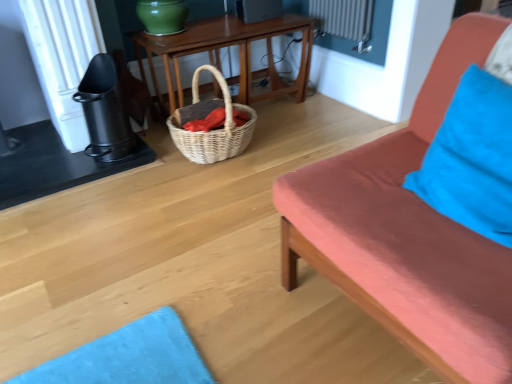
Question: Looking at the image, does blue fabric pillow at right seem bigger or smaller compared to woven wood table at center?

Choices:
 (A) small
 (B) big

Answer: (A)

Question: From a real-world perspective, relative to woven wood table at center, is blue fabric pillow at right vertically above or below?

Choices:
 (A) above
 (B) below

Answer: (A)

Question: Which is nearer to the woven wicker basket at center?

Choices:
 (A) matte coral studio couch at right
 (B) woven natural picnic basket at center
 (C) woven wood table at center
 (D) blue fabric pillow at right

Answer: (B)

Question: Which object is the closest to the woven natural picnic basket at center?

Choices:
 (A) matte coral studio couch at right
 (B) woven wood table at center
 (C) blue fabric pillow at right
 (D) woven wicker basket at center

Answer: (D)